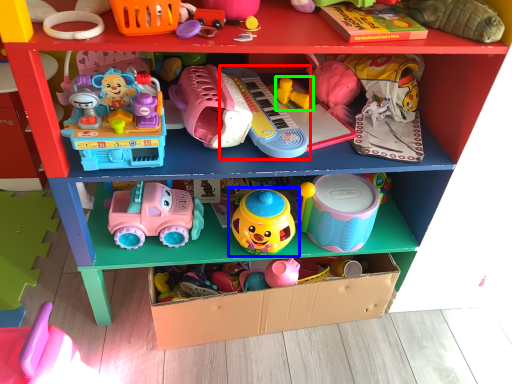
Question: Estimate the real-world distances between objects in this image. Which object is farther from toy (highlighted by a red box), toy (highlighted by a blue box) or toy (highlighted by a green box)?

Choices:
 (A) toy
 (B) toy

Answer: (A)